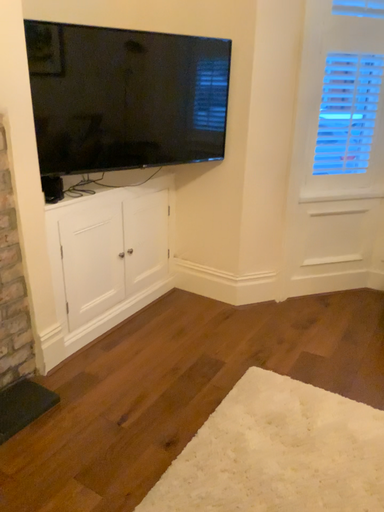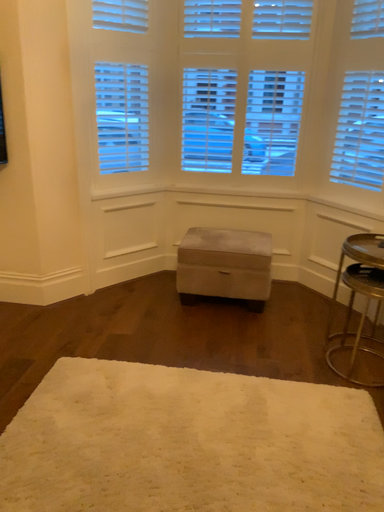
Question: How did the camera likely rotate when shooting the video?

Choices:
 (A) rotated right
 (B) rotated left

Answer: (A)